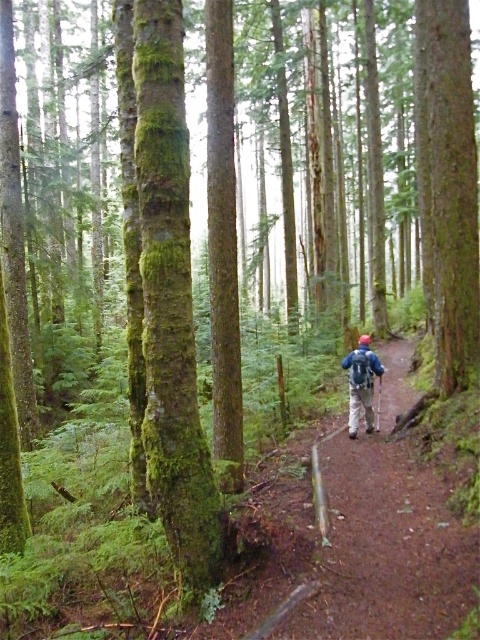
Which is more to the left, green mossy tree trunk at center or blue matte jacket at center?

From the viewer's perspective, green mossy tree trunk at center appears more on the left side.

Who is higher up, green mossy tree trunk at center or blue matte jacket at center?

Positioned higher is green mossy tree trunk at center.

Which is behind, point (213, 532) or point (373, 369)?

The point (373, 369) is behind.

Where is `green mossy tree trunk at center`? green mossy tree trunk at center is located at coordinates (163, 291).

Where is `green mossy tree trunk at center`? green mossy tree trunk at center is located at coordinates (163, 291).

Can you confirm if green mossy tree trunk at center is bigger than blue fabric backpack at center?

Indeed, green mossy tree trunk at center has a larger size compared to blue fabric backpack at center.

Measure the distance between green mossy tree trunk at center and camera.

A distance of 12.91 feet exists between green mossy tree trunk at center and camera.

Where is `green mossy tree trunk at center`? green mossy tree trunk at center is located at coordinates (163, 291).

Which of these two, blue fabric backpack at center or blue matte jacket at center, stands taller?

blue fabric backpack at center is taller.

Is point (363, 364) farther from camera compared to point (357, 371)?

Yes, point (363, 364) is behind point (357, 371).

Find the location of a particular element. blue fabric backpack at center is located at coordinates (360, 384).